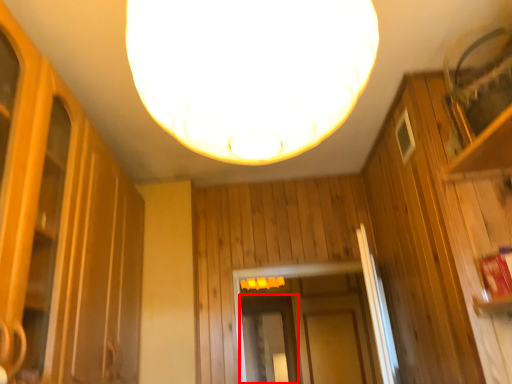
Question: From the image's perspective, where is screen door (annotated by the red box) located relative to lamp?

Choices:
 (A) above
 (B) below

Answer: (B)